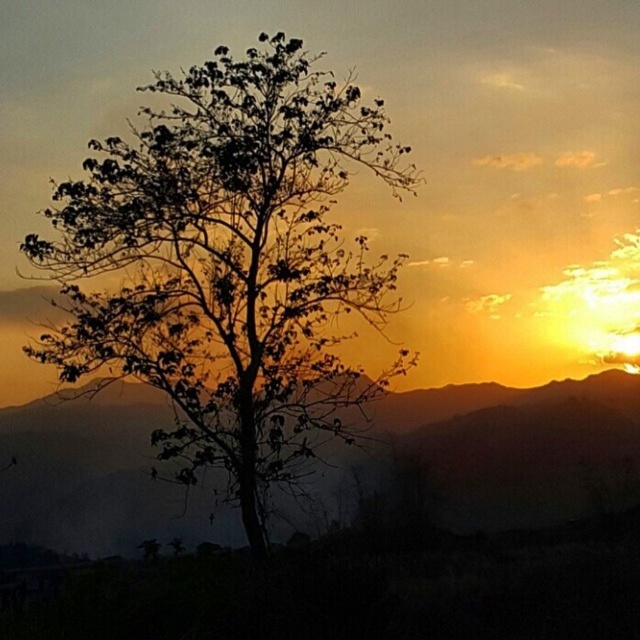
Question: Does silhouette leafy tree at center appear on the right side of silky orange mountain at center?

Choices:
 (A) no
 (B) yes

Answer: (A)

Question: Can you confirm if silhouette leafy tree at center is thinner than silky orange mountain at center?

Choices:
 (A) no
 (B) yes

Answer: (B)

Question: Can you confirm if silhouette leafy tree at center is thinner than silky orange mountain at center?

Choices:
 (A) no
 (B) yes

Answer: (B)